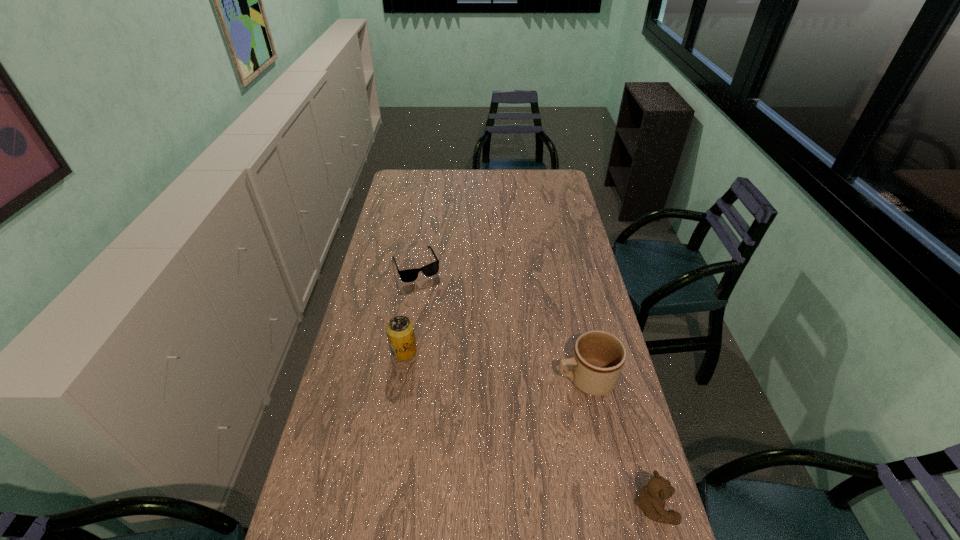
Locate an element on the screen. vacant position located 0.100m on the front-facing side of the shortest object is located at coordinates (432, 300).

Find the location of a particular element. The height and width of the screenshot is (540, 960). free space located 0.170m on the front-facing side of the shortest object is located at coordinates (438, 312).

Locate an element on the screen. The width and height of the screenshot is (960, 540). object located at the near edge is located at coordinates (651, 499).

Where is `beer can present at the left edge`? beer can present at the left edge is located at coordinates (400, 331).

Where is `sunglasses present at the left edge`? Image resolution: width=960 pixels, height=540 pixels. sunglasses present at the left edge is located at coordinates (409, 275).

The image size is (960, 540). I want to click on teddy bear that is at the right edge, so click(651, 499).

This screenshot has height=540, width=960. I want to click on mug that is at the right edge, so click(598, 358).

Locate an element on the screen. This screenshot has height=540, width=960. object present at the near right corner is located at coordinates (651, 499).

Where is `vacant space at the far edge of the desktop`? This screenshot has width=960, height=540. vacant space at the far edge of the desktop is located at coordinates (466, 174).

Find the location of `free space at the near edge of the desktop`. free space at the near edge of the desktop is located at coordinates (428, 539).